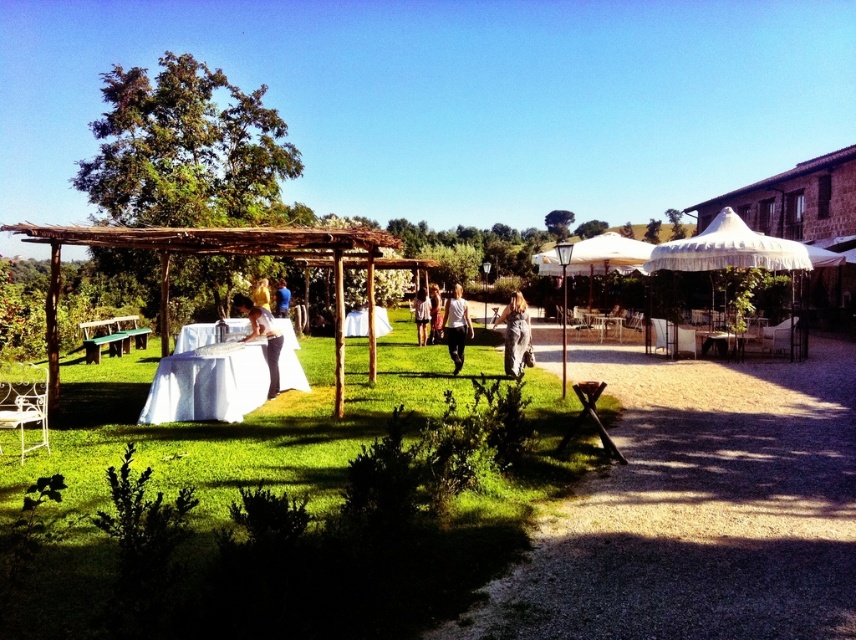
Who is positioned more to the right, white cloth-covered table at center or matte white tablecloth at center?

Positioned to the right is matte white tablecloth at center.

Describe the element at coordinates (207, 376) in the screenshot. The image size is (856, 640). I see `white cloth-covered table at center` at that location.

This screenshot has height=640, width=856. I want to click on white cloth-covered table at center, so click(x=207, y=376).

Between white wrought iron chair at lower left and matte white tablecloth at center, which one has less height?

white wrought iron chair at lower left

Who is more forward, [1,403] or [241,310]?

Point [1,403] is more forward.

At what (x,y) coordinates should I click in order to perform the action: click on white wrought iron chair at lower left. Please return your answer as a coordinate pair (x, y). Looking at the image, I should click on (22, 401).

Is wooden pergola at left shorter than golden hair at center?

Incorrect, wooden pergola at left's height does not fall short of golden hair at center's.

Which is more to the left, wooden pergola at left or golden hair at center?

From the viewer's perspective, wooden pergola at left appears more on the left side.

Image resolution: width=856 pixels, height=640 pixels. I want to click on wooden pergola at left, so click(x=236, y=253).